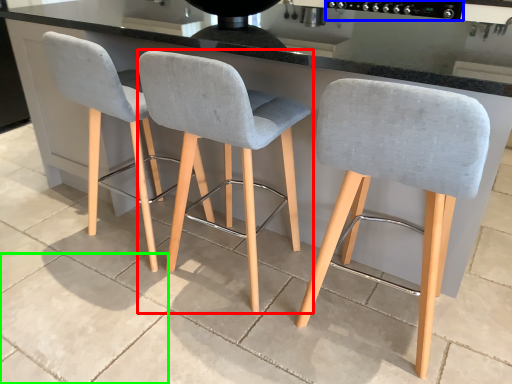
Question: Considering the real-world distances, which object is closest to chair (highlighted by a red box)? appliance (highlighted by a blue box) or concrete (highlighted by a green box).

Choices:
 (A) appliance
 (B) concrete

Answer: (B)